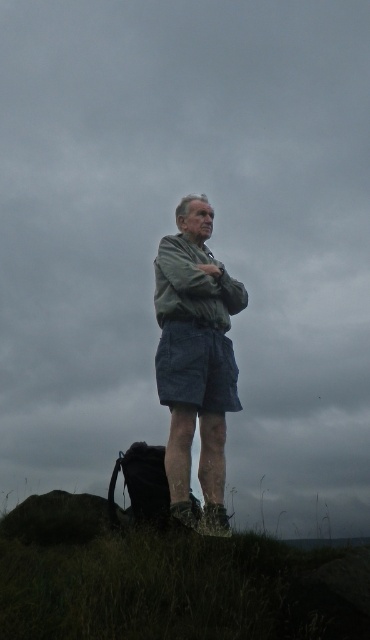
Which of these two, green grassy at lower center or green fabric shirt at center, stands shorter?

green grassy at lower center

Is green grassy at lower center to the right of green fabric shirt at center from the viewer's perspective?

No, green grassy at lower center is not to the right of green fabric shirt at center.

Where is `green grassy at lower center`? green grassy at lower center is located at coordinates [x=167, y=580].